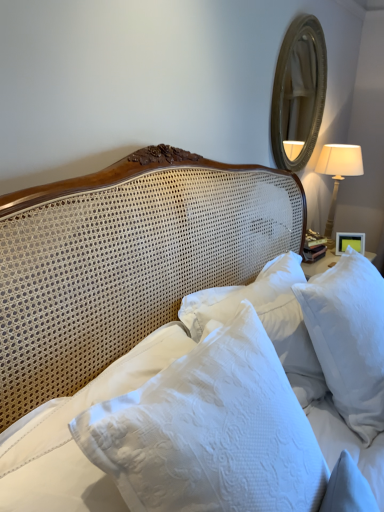
Where is `white textured pillows at center`? The width and height of the screenshot is (384, 512). white textured pillows at center is located at coordinates (116, 295).

In order to click on gold-toned wooden mirror at upper right in this screenshot , I will do `click(299, 91)`.

Image resolution: width=384 pixels, height=512 pixels. What do you see at coordinates (338, 174) in the screenshot? I see `white fabric lampshade at right` at bounding box center [338, 174].

You are a GUI agent. You are given a task and a screenshot of the screen. Output one action in this format:
    pyautogui.click(x=<x>, y=<y>)
    Task: Click on the white fabric lampshade at right
    This screenshot has height=512, width=384.
    Given the screenshot: What is the action you would take?
    pyautogui.click(x=338, y=174)

The width and height of the screenshot is (384, 512). What do you see at coordinates (350, 242) in the screenshot? I see `white glossy picture frame at upper right` at bounding box center [350, 242].

What are the coordinates of `white textured pillows at center` in the screenshot? It's located at (116, 295).

Can you confirm if white glossy picture frame at upper right is smaller than white textured pillow at center, acting as the 2th pillow starting from the right?

Yes, white glossy picture frame at upper right is smaller than white textured pillow at center, acting as the 2th pillow starting from the right.

Looking at this image, can you confirm if white glossy picture frame at upper right is positioned to the right of white textured pillow at center, which is counted as the 1th pillow, starting from the left?

Correct, you'll find white glossy picture frame at upper right to the right of white textured pillow at center, which is counted as the 1th pillow, starting from the left.

Which is further, (347, 241) or (158, 447)?

The point (347, 241) is behind.

Could you tell me if white glossy picture frame at upper right is turned towards white textured pillow at center, which is counted as the 1th pillow, starting from the left?

No, white glossy picture frame at upper right is not facing towards white textured pillow at center, which is counted as the 1th pillow, starting from the left.

From a real-world perspective, is white fabric lampshade at right beneath gold-toned wooden mirror at upper right?

Indeed, from a real-world perspective, white fabric lampshade at right is positioned beneath gold-toned wooden mirror at upper right.

Which is correct: white fabric lampshade at right is inside gold-toned wooden mirror at upper right, or outside of it?

white fabric lampshade at right cannot be found inside gold-toned wooden mirror at upper right.

Which point is more forward, (332, 204) or (291, 119)?

Positioned in front is point (332, 204).

In the image, is gold-toned wooden mirror at upper right on the left side or the right side of white textured pillows at center?

From the image, it's evident that gold-toned wooden mirror at upper right is to the right of white textured pillows at center.

Based on the photo, is gold-toned wooden mirror at upper right completely or partially outside of white textured pillows at center?

gold-toned wooden mirror at upper right is positioned outside white textured pillows at center.

From their relative heights in the image, would you say gold-toned wooden mirror at upper right is taller or shorter than white textured pillows at center?

gold-toned wooden mirror at upper right is taller than white textured pillows at center.

How many degrees apart are the facing directions of gold-toned wooden mirror at upper right and white textured pillows at center?

The angular difference between gold-toned wooden mirror at upper right and white textured pillows at center is 3.74 degrees.

How different are the orientations of white glossy picture frame at upper right and white textured pillows at center in degrees?

The angle between the facing direction of white glossy picture frame at upper right and the facing direction of white textured pillows at center is 50.6 degrees.

Locate an element on the screen. The width and height of the screenshot is (384, 512). picture frame directly beneath the white textured pillows at center (from a real-world perspective) is located at coordinates (350, 242).

Considering the relative sizes of white glossy picture frame at upper right and white textured pillows at center in the image provided, is white glossy picture frame at upper right smaller than white textured pillows at center?

Correct, white glossy picture frame at upper right occupies less space than white textured pillows at center.

Is white glossy picture frame at upper right with white textured pillows at center?

white glossy picture frame at upper right and white textured pillows at center are clearly separated.

How many degrees apart are the facing directions of white fabric lampshade at right and white textured pillow at upper right, the second pillow in the left-to-right sequence?

white fabric lampshade at right and white textured pillow at upper right, the second pillow in the left-to-right sequence, are facing 6.16 degrees away from each other.

Which point is more distant from viewer, (332, 153) or (357, 367)?

The point (332, 153) is farther.

Is white fabric lampshade at right turned away from white textured pillow at upper right, the second pillow in the left-to-right sequence?

No, white fabric lampshade at right's orientation is not away from white textured pillow at upper right, the second pillow in the left-to-right sequence.

Could you measure the distance between white textured pillows at center and white textured pillow at center, which is counted as the 1th pillow, starting from the left?

They are 11.83 inches apart.

Which of these two, white textured pillows at center or white textured pillow at center, acting as the 2th pillow starting from the right, stands taller?

With more height is white textured pillows at center.

Which is more to the right, white textured pillows at center or white textured pillow at center, acting as the 2th pillow starting from the right?

white textured pillows at center.

Is white textured pillows at center turned away from white textured pillow at center, acting as the 2th pillow starting from the right?

Absolutely, white textured pillows at center is directed away from white textured pillow at center, acting as the 2th pillow starting from the right.

From the image's perspective, is white textured pillow at upper right, positioned as the 1th pillow in right-to-left order, above gold-toned wooden mirror at upper right?

No.

Considering the relative positions of white textured pillow at upper right, positioned as the 1th pillow in right-to-left order, and gold-toned wooden mirror at upper right in the image provided, is white textured pillow at upper right, positioned as the 1th pillow in right-to-left order, behind gold-toned wooden mirror at upper right?

No, white textured pillow at upper right, positioned as the 1th pillow in right-to-left order, is closer to the camera.

Considering the relative positions of white textured pillow at upper right, positioned as the 1th pillow in right-to-left order, and gold-toned wooden mirror at upper right in the image provided, is white textured pillow at upper right, positioned as the 1th pillow in right-to-left order, to the left of gold-toned wooden mirror at upper right from the viewer's perspective?

Answer: No.

In the image, there is a white textured pillow at upper right, the second pillow in the left-to-right sequence. Where is `mirror above it (from the image's perspective)`? mirror above it (from the image's perspective) is located at coordinates (299, 91).

You are a GUI agent. You are given a task and a screenshot of the screen. Output one action in this format:
    pyautogui.click(x=<x>, y=<y>)
    Task: Click on the picture frame above the white textured pillow at center, acting as the 2th pillow starting from the right (from a real-world perspective)
    This screenshot has height=512, width=384.
    Given the screenshot: What is the action you would take?
    coord(350,242)

This screenshot has height=512, width=384. Identify the location of mirror lying above the white fabric lampshade at right (from the image's perspective). (299, 91).

When comparing their distances from white glossy picture frame at upper right, does white textured pillows at center or gold-toned wooden mirror at upper right seem further?

white textured pillows at center is further to white glossy picture frame at upper right.

From the picture: Which object lies further to the anchor point gold-toned wooden mirror at upper right, white textured pillow at center, acting as the 2th pillow starting from the right, or white fabric lampshade at right?

white textured pillow at center, acting as the 2th pillow starting from the right, is positioned further to the anchor gold-toned wooden mirror at upper right.

From the image, which object appears to be nearer to white fabric lampshade at right, white textured pillows at center or white textured pillow at upper right, the second pillow in the left-to-right sequence?

Among the two, white textured pillow at upper right, the second pillow in the left-to-right sequence, is located nearer to white fabric lampshade at right.

When comparing their distances from gold-toned wooden mirror at upper right, does white textured pillow at center, which is counted as the 1th pillow, starting from the left, or white glossy picture frame at upper right seem closer?

The object closer to gold-toned wooden mirror at upper right is white glossy picture frame at upper right.

Considering their positions, is white textured pillow at upper right, positioned as the 1th pillow in right-to-left order, positioned further to gold-toned wooden mirror at upper right than white fabric lampshade at right?

The object further to gold-toned wooden mirror at upper right is white textured pillow at upper right, positioned as the 1th pillow in right-to-left order.

Estimate the real-world distances between objects in this image. Which object is further from white glossy picture frame at upper right, white textured pillows at center or white textured pillow at center, which is counted as the 1th pillow, starting from the left?

The object further to white glossy picture frame at upper right is white textured pillow at center, which is counted as the 1th pillow, starting from the left.

Estimate the real-world distances between objects in this image. Which object is further from gold-toned wooden mirror at upper right, white textured pillows at center or white textured pillow at center, acting as the 2th pillow starting from the right?

white textured pillow at center, acting as the 2th pillow starting from the right, is positioned further to the anchor gold-toned wooden mirror at upper right.

Considering their positions, is white fabric lampshade at right positioned further to white glossy picture frame at upper right than gold-toned wooden mirror at upper right?

gold-toned wooden mirror at upper right is positioned further to the anchor white glossy picture frame at upper right.

Find the location of a particular element. pillow located between white textured pillow at center, acting as the 2th pillow starting from the right, and gold-toned wooden mirror at upper right in the depth direction is located at coordinates (349, 338).

Where is `mirror positioned between white textured pillow at center, which is counted as the 1th pillow, starting from the left, and white fabric lampshade at right from near to far`? Image resolution: width=384 pixels, height=512 pixels. mirror positioned between white textured pillow at center, which is counted as the 1th pillow, starting from the left, and white fabric lampshade at right from near to far is located at coordinates (299, 91).

The width and height of the screenshot is (384, 512). Find the location of `mirror located between white textured pillow at upper right, positioned as the 1th pillow in right-to-left order, and white fabric lampshade at right in the depth direction`. mirror located between white textured pillow at upper right, positioned as the 1th pillow in right-to-left order, and white fabric lampshade at right in the depth direction is located at coordinates (299, 91).

Identify the location of mirror between white textured pillows at center and white glossy picture frame at upper right in the front-back direction. (299, 91).